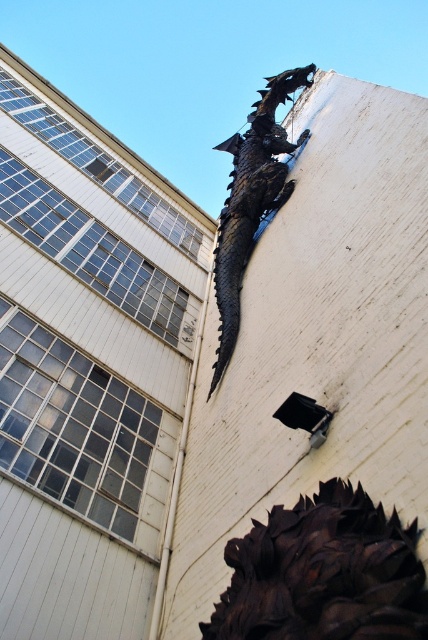
Question: Does rusty metal dragon at upper right have a smaller size compared to dark matte metal dragon at upper center?

Choices:
 (A) no
 (B) yes

Answer: (B)

Question: Which object is closer to the camera taking this photo?

Choices:
 (A) dark matte metal dragon at upper center
 (B) rusty metal dragon at upper right

Answer: (B)

Question: Does rusty metal dragon at upper right appear on the left side of dark matte metal dragon at upper center?

Choices:
 (A) yes
 (B) no

Answer: (A)

Question: Can you confirm if rusty metal dragon at upper right is positioned to the right of dark matte metal dragon at upper center?

Choices:
 (A) yes
 (B) no

Answer: (B)